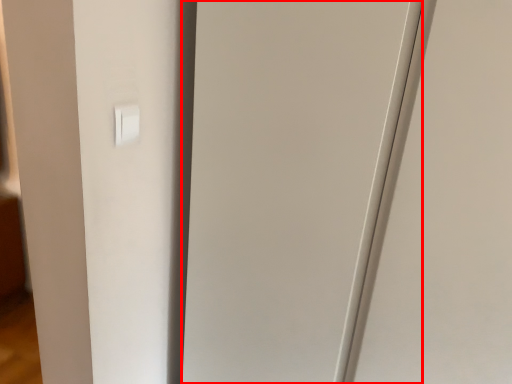
Question: Considering the relative positions of glass door (annotated by the red box) and light switch in the image provided, where is glass door (annotated by the red box) located with respect to the staircase?

Choices:
 (A) left
 (B) right

Answer: (B)